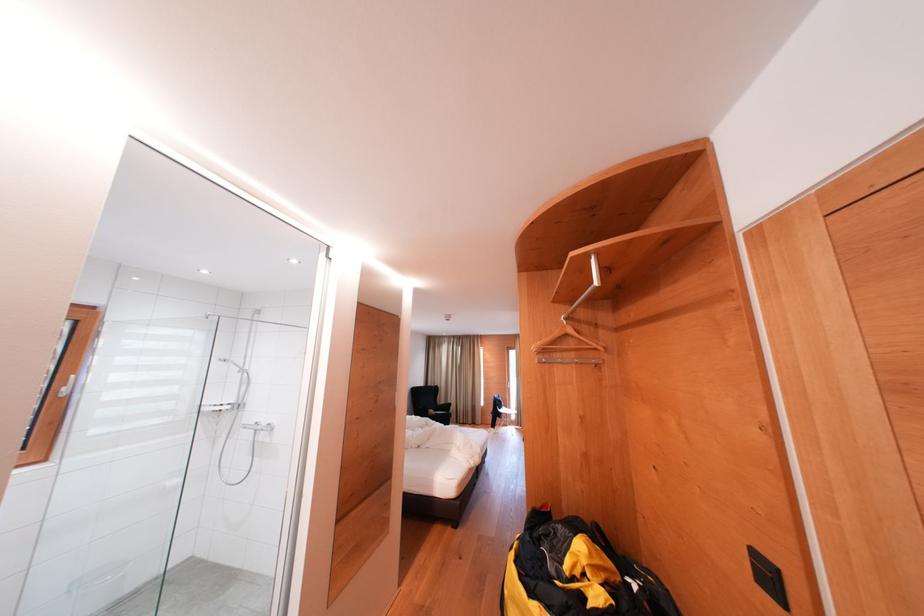
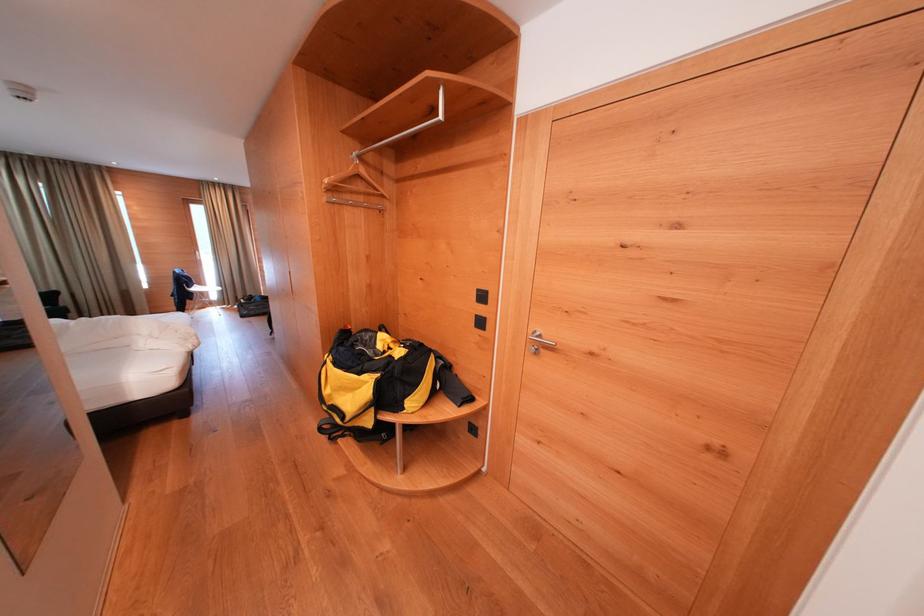
First-person continuous shooting, in which direction is the camera rotating?

The camera rotated toward right-down.